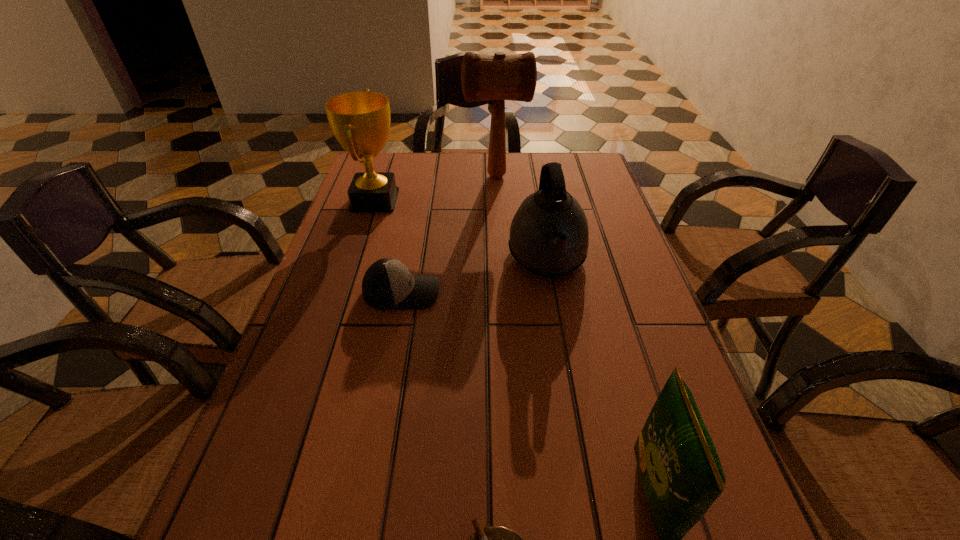
You are a GUI agent. You are given a task and a screenshot of the screen. Output one action in this format:
    pyautogui.click(x=<x>, y=<y>)
    Task: Click on the blank space at the far right corner of the desktop
    Image resolution: width=960 pixels, height=540 pixels.
    Given the screenshot: What is the action you would take?
    pyautogui.click(x=569, y=180)

You are a GUI agent. You are given a task and a screenshot of the screen. Output one action in this format:
    pyautogui.click(x=<x>, y=<y>)
    Task: Click on the free point between the second shortest object and the award
    This screenshot has width=960, height=540.
    Given the screenshot: What is the action you would take?
    pyautogui.click(x=388, y=246)

At what (x,y) coordinates should I click in order to perform the action: click on free space between the fifth shortest object and the cap. Please return your answer as a coordinate pair (x, y). Image resolution: width=960 pixels, height=540 pixels. Looking at the image, I should click on (388, 246).

Image resolution: width=960 pixels, height=540 pixels. Identify the location of vacant area that lies between the cap and the kettle. (474, 276).

Choose which object is the fourth nearest neighbor to the award. Please provide its 2D coordinates. Your answer should be formatted as a tuple, i.e. [(x, y)], where the tuple contains the x and y coordinates of a point satisfying the conditions above.

[(492, 539)]

The height and width of the screenshot is (540, 960). Identify the location of object that is the third closest to the award. (549, 236).